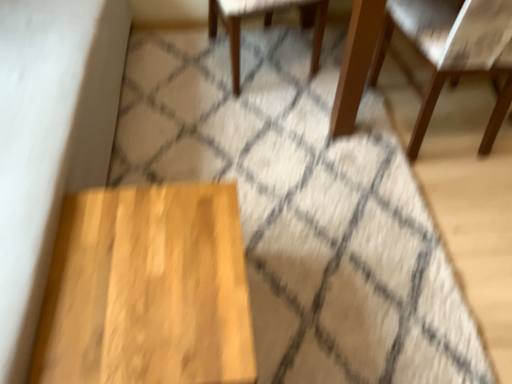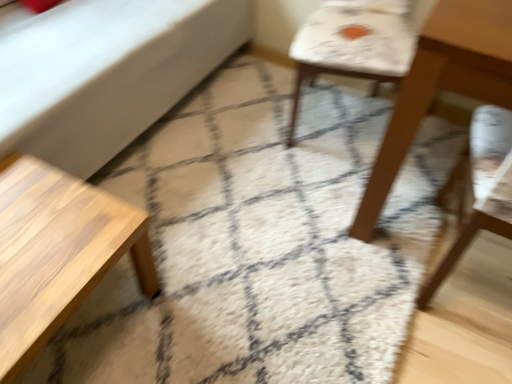
Question: Which way did the camera rotate in the video?

Choices:
 (A) rotated left
 (B) rotated right

Answer: (A)